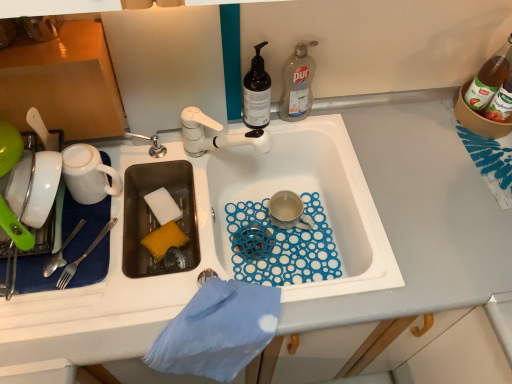
Question: Is shiny silver fork at left with matte ceramic mug at center, the first coffee cup viewed from the right?

Choices:
 (A) yes
 (B) no

Answer: (B)

Question: Is matte ceramic mug at center, which ranks as the 2th coffee cup in front-to-back order, a part of shiny silver fork at left?

Choices:
 (A) no
 (B) yes

Answer: (A)

Question: Is shiny silver fork at left bigger than matte ceramic mug at center, positioned as the 2th coffee cup in left-to-right order?

Choices:
 (A) yes
 (B) no

Answer: (B)

Question: Does shiny silver fork at left have a greater height compared to matte ceramic mug at center, which ranks as the 2th coffee cup in front-to-back order?

Choices:
 (A) no
 (B) yes

Answer: (A)

Question: From a real-world perspective, is shiny silver fork at left beneath matte ceramic mug at center, positioned as the 2th coffee cup in left-to-right order?

Choices:
 (A) yes
 (B) no

Answer: (B)

Question: From the image's perspective, is shiny silver fork at left over matte ceramic mug at center, positioned as the 2th coffee cup in left-to-right order?

Choices:
 (A) no
 (B) yes

Answer: (A)

Question: Considering the relative positions of white matte mug at upper left, the first coffee cup viewed from the left, and white sponge at sink left, which appears as the first food when viewed from the top, in the image provided, is white matte mug at upper left, the first coffee cup viewed from the left, behind white sponge at sink left, which appears as the first food when viewed from the top,?

Choices:
 (A) no
 (B) yes

Answer: (A)

Question: From a real-world perspective, does white matte mug at upper left, marked as the 2th coffee cup in a back-to-front arrangement, sit lower than white sponge at sink left, arranged as the 2th food when ordered from the bottom?

Choices:
 (A) yes
 (B) no

Answer: (B)

Question: Is white matte mug at upper left, the 1th coffee cup from the front, at the right side of white sponge at sink left, which appears as the first food when viewed from the top?

Choices:
 (A) yes
 (B) no

Answer: (B)

Question: Is white matte mug at upper left, the first coffee cup viewed from the left, outside white sponge at sink left, arranged as the 2th food when ordered from the bottom?

Choices:
 (A) yes
 (B) no

Answer: (A)

Question: Is white matte mug at upper left, the first coffee cup viewed from the left, turned away from white sponge at sink left, arranged as the 2th food when ordered from the bottom?

Choices:
 (A) yes
 (B) no

Answer: (B)

Question: Is white matte mug at upper left, the first coffee cup viewed from the left, positioned in front of white sponge at sink left, arranged as the 2th food when ordered from the bottom?

Choices:
 (A) yes
 (B) no

Answer: (A)

Question: Can you confirm if translucent dark brown bottle at upper center, the first bottle when ordered from left to right, is shorter than matte ceramic mug at center, which ranks as the 2th coffee cup in front-to-back order?

Choices:
 (A) yes
 (B) no

Answer: (B)